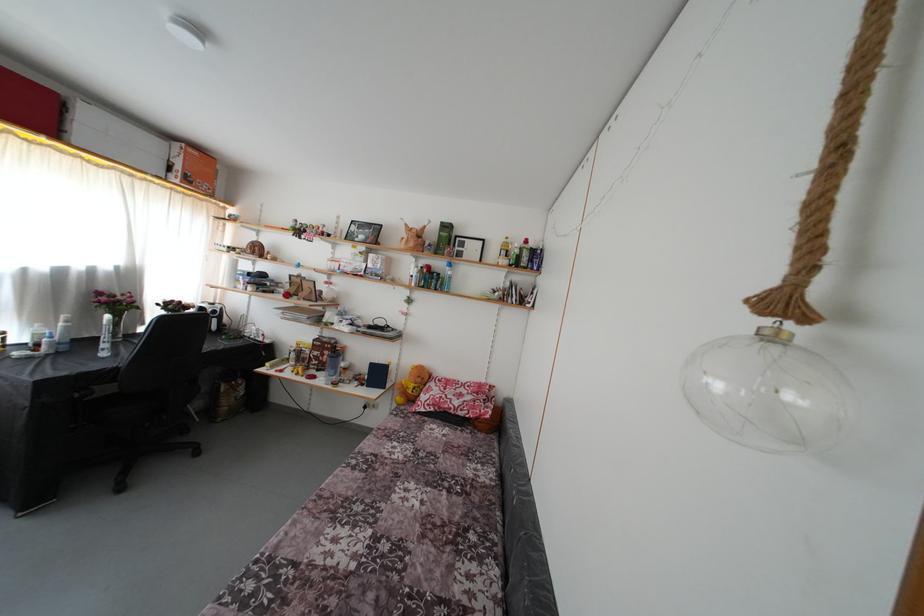
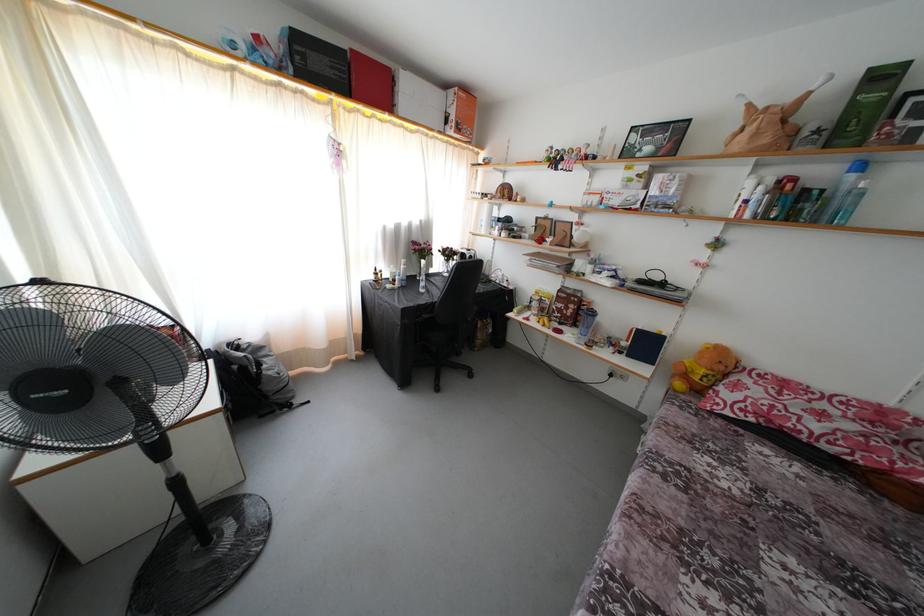
In the second image, find the point that corresponds to the point at 424,386 in the first image.

(726, 373)